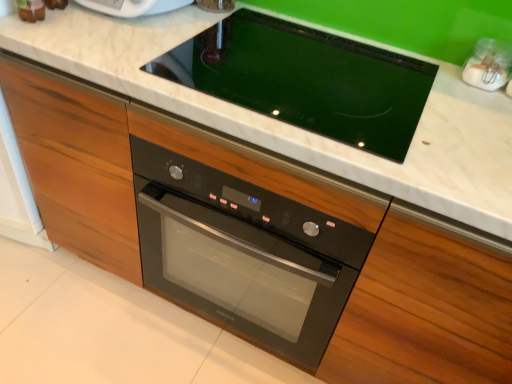
Question: Would you say black glass oven at center is outside white marble countertop at center?

Choices:
 (A) no
 (B) yes

Answer: (A)

Question: Is black glass oven at center oriented away from white marble countertop at center?

Choices:
 (A) no
 (B) yes

Answer: (B)

Question: From the image's perspective, does black glass oven at center appear higher than white marble countertop at center?

Choices:
 (A) yes
 (B) no

Answer: (B)

Question: Is black glass oven at center far from white marble countertop at center?

Choices:
 (A) no
 (B) yes

Answer: (A)

Question: Is the depth of black glass oven at center less than that of white marble countertop at center?

Choices:
 (A) no
 (B) yes

Answer: (A)

Question: Considering the relative positions of black glass oven at center and white marble countertop at center in the image provided, is black glass oven at center to the left of white marble countertop at center from the viewer's perspective?

Choices:
 (A) no
 (B) yes

Answer: (B)

Question: From the image's perspective, is white marble countertop at center above black glass cooktop at center?

Choices:
 (A) no
 (B) yes

Answer: (A)

Question: From a real-world perspective, is white marble countertop at center on black glass cooktop at center?

Choices:
 (A) no
 (B) yes

Answer: (A)

Question: Is white marble countertop at center thinner than black glass cooktop at center?

Choices:
 (A) yes
 (B) no

Answer: (B)

Question: Could you tell me if white marble countertop at center is turned towards black glass cooktop at center?

Choices:
 (A) yes
 (B) no

Answer: (B)

Question: Would you say white marble countertop at center is outside black glass cooktop at center?

Choices:
 (A) no
 (B) yes

Answer: (B)

Question: From the image's perspective, would you say white marble countertop at center is shown under black glass cooktop at center?

Choices:
 (A) yes
 (B) no

Answer: (A)

Question: Is white marble countertop at center located within black glass cooktop at center?

Choices:
 (A) yes
 (B) no

Answer: (B)